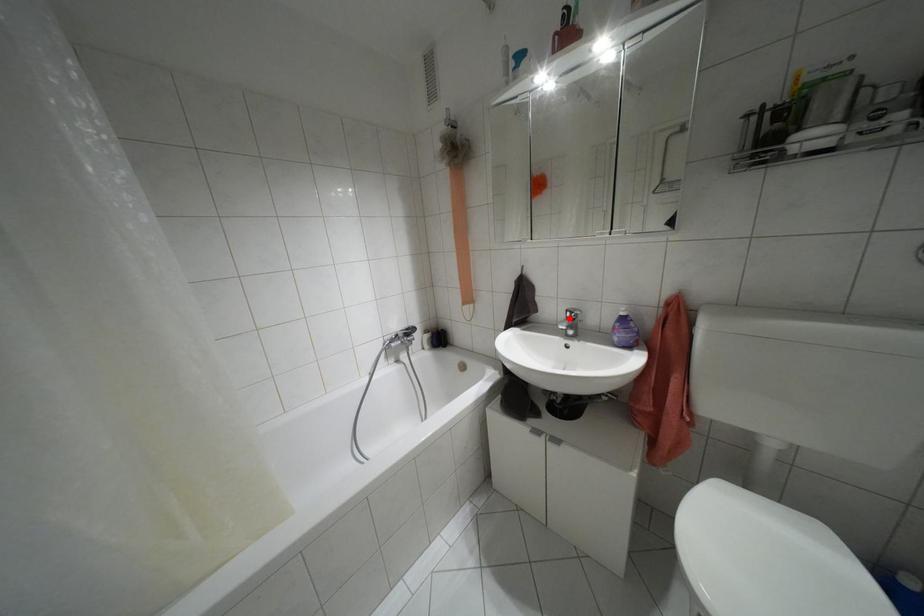
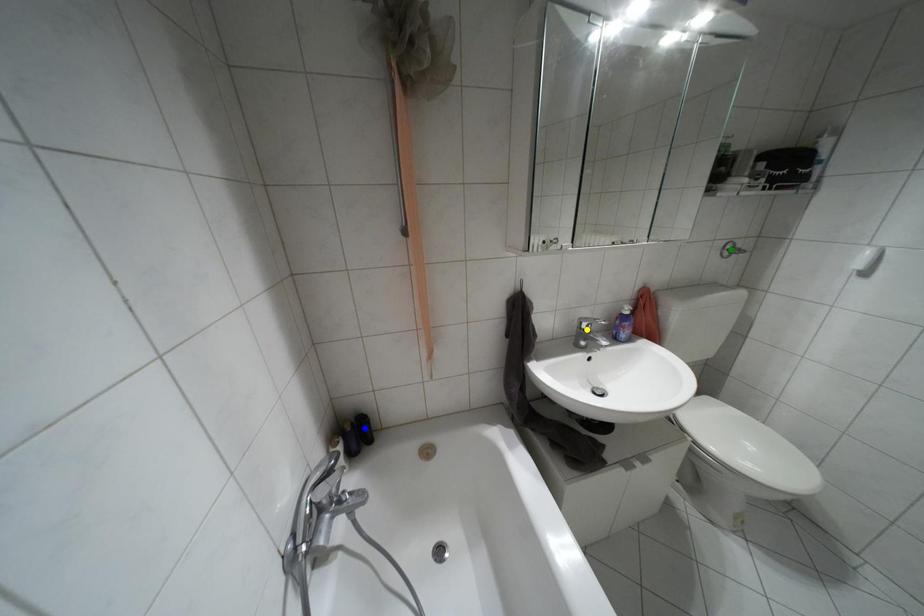
Question: I am providing you with two images of the same scene from different viewpoints. A red point is marked on the first image. You are given multiple points on the second image. In image 2, which mark is for the same physical point as the one in image 1?

Choices:
 (A) green point
 (B) blue point
 (C) yellow point

Answer: (C)